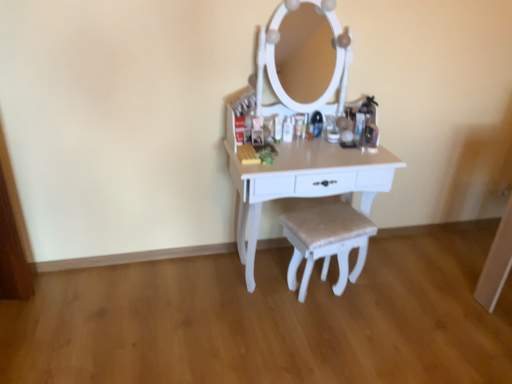
Question: From a real-world perspective, is white painted wood table at center located beneath beige fabric stool at center?

Choices:
 (A) no
 (B) yes

Answer: (A)

Question: Is white painted wood table at center facing towards beige fabric stool at center?

Choices:
 (A) no
 (B) yes

Answer: (B)

Question: From the image's perspective, is white painted wood table at center below beige fabric stool at center?

Choices:
 (A) no
 (B) yes

Answer: (A)

Question: Considering the relative positions of white painted wood table at center and beige fabric stool at center in the image provided, is white painted wood table at center to the right of beige fabric stool at center from the viewer's perspective?

Choices:
 (A) yes
 (B) no

Answer: (B)

Question: Does white painted wood table at center appear on the left side of beige fabric stool at center?

Choices:
 (A) no
 (B) yes

Answer: (B)

Question: Is white painted wood table at center in front of beige fabric stool at center?

Choices:
 (A) yes
 (B) no

Answer: (A)

Question: Would you say beige fabric stool at center is outside white painted wood table at center?

Choices:
 (A) no
 (B) yes

Answer: (A)

Question: Is beige fabric stool at center smaller than white painted wood table at center?

Choices:
 (A) yes
 (B) no

Answer: (A)

Question: Can you confirm if beige fabric stool at center is shorter than white painted wood table at center?

Choices:
 (A) yes
 (B) no

Answer: (A)

Question: Would you say beige fabric stool at center is a long distance from white painted wood table at center?

Choices:
 (A) no
 (B) yes

Answer: (A)

Question: Does beige fabric stool at center turn towards white painted wood table at center?

Choices:
 (A) no
 (B) yes

Answer: (B)

Question: Considering the relative sizes of beige fabric stool at center and white painted wood table at center in the image provided, is beige fabric stool at center taller than white painted wood table at center?

Choices:
 (A) no
 (B) yes

Answer: (A)

Question: Is white painted wood table at center taller or shorter than beige fabric stool at center?

Choices:
 (A) tall
 (B) short

Answer: (A)